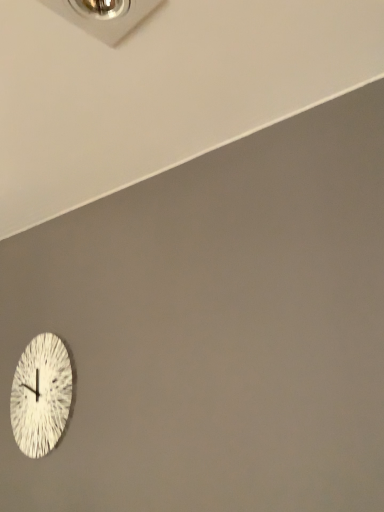
Question: From the image's perspective, is metallic silver outlet at upper center above or below white textured clock at lower left?

Choices:
 (A) below
 (B) above

Answer: (B)

Question: Looking at their shapes, would you say metallic silver outlet at upper center is wider or thinner than white textured clock at lower left?

Choices:
 (A) thin
 (B) wide

Answer: (B)

Question: Considering their positions, is metallic silver outlet at upper center located in front of or behind white textured clock at lower left?

Choices:
 (A) behind
 (B) front

Answer: (B)

Question: Considering the positions of white textured clock at lower left and metallic silver outlet at upper center in the image, is white textured clock at lower left bigger or smaller than metallic silver outlet at upper center?

Choices:
 (A) small
 (B) big

Answer: (B)

Question: Would you say white textured clock at lower left is to the left or to the right of metallic silver outlet at upper center in the picture?

Choices:
 (A) left
 (B) right

Answer: (A)

Question: From their relative heights in the image, would you say white textured clock at lower left is taller or shorter than metallic silver outlet at upper center?

Choices:
 (A) short
 (B) tall

Answer: (B)

Question: From the image's perspective, relative to metallic silver outlet at upper center, is white textured clock at lower left above or below?

Choices:
 (A) below
 (B) above

Answer: (A)